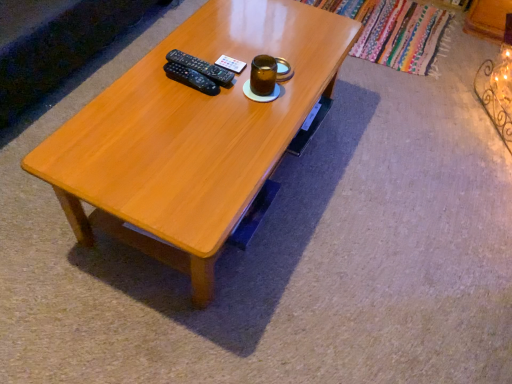
Locate an element on the screen. This screenshot has width=512, height=384. spots to the right of light brown wood coffee table at center is located at coordinates tap(397, 214).